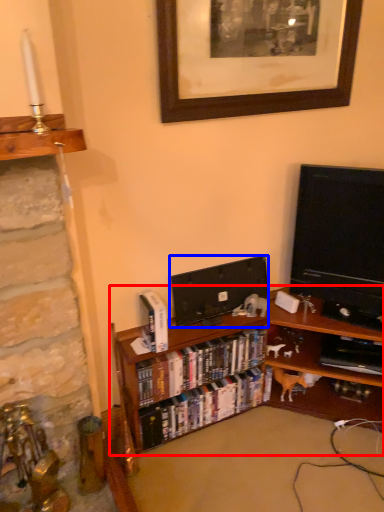
Question: Among these objects, which one is nearest to the camera, bookcase (highlighted by a red box) or television (highlighted by a blue box)?

Choices:
 (A) bookcase
 (B) television

Answer: (A)